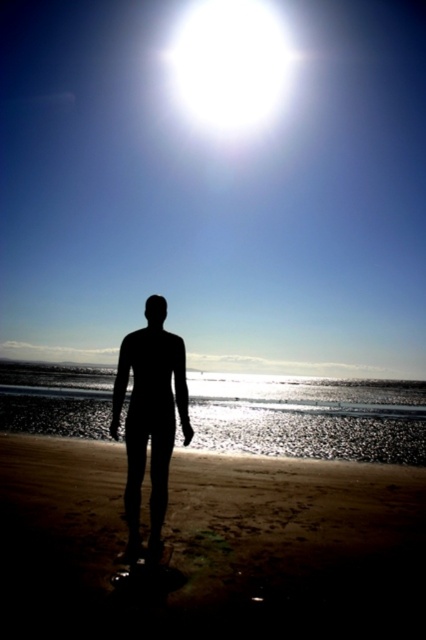
You are a photographer trying to capture the silhouette of the black matte figure at center against the brown sandy beach at lower center. Based on the scene description, will the figure be clearly visible against the background?

The brown sandy beach at lower center is positioned under the black matte figure at center, so the figure will be clearly visible as its silhouette will contrast against the lighter background.

You are a drone operator trying to capture the silhouette of the human figure in the image. The human figure is standing on the brown sandy beach at lower center, which is represented by point [212,547]. To ensure the silhouette is clear against the bright sun, where should you position the drone relative to the human figure? Choose between left, right, front, or back.

The human figure is facing away from the viewer towards the horizon where the sun is located. To capture a clear silhouette, the drone should be positioned in front of the human figure so that the sun is behind the figure, creating the silhouette effect.

You are a photographer trying to capture the silhouette of the human figure on the beach. You notice the brown sandy beach at lower center and the transparent plastic surfboard at lower center. Which object is wider in the image?

The brown sandy beach at lower center is wider than the transparent plastic surfboard at lower center according to the description.